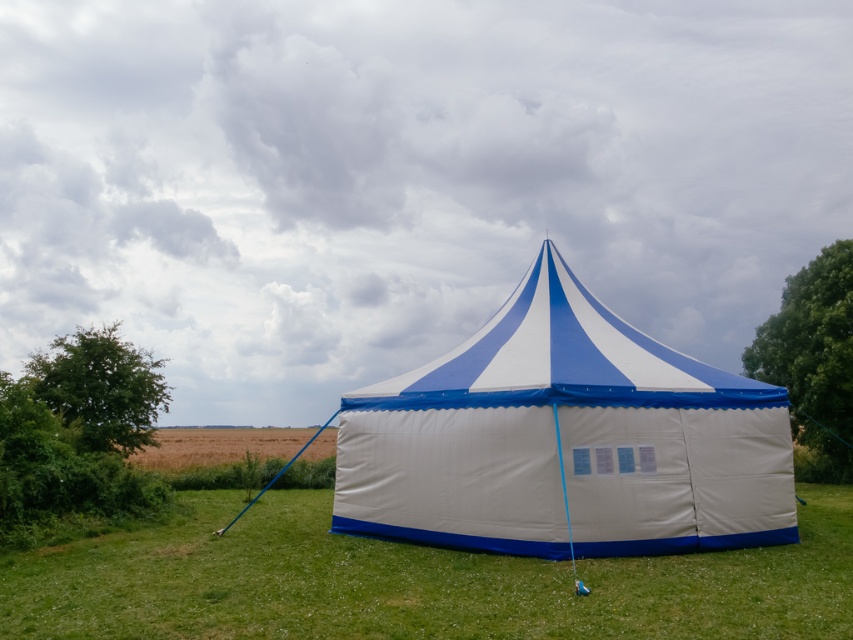
You are standing in front of the tent and want to place a decoration. You have two points marked on the tent where you can hang it. The points are labeled as point 1 at coordinates point (x=248, y=618) and point 2 at coordinates point (x=799, y=307). Which point is closer to you?

Point (x=248, y=618) is closer to the viewer than point (x=799, y=307), so you should hang the decoration at point (x=248, y=618).

You are standing in front of a large blue and white striped tent in a grassy field. You see the green grass at lower center and the green leafy tree at left. Which object is positioned to the right of the other?

The green grass at lower center is positioned to the right of the green leafy tree at left.